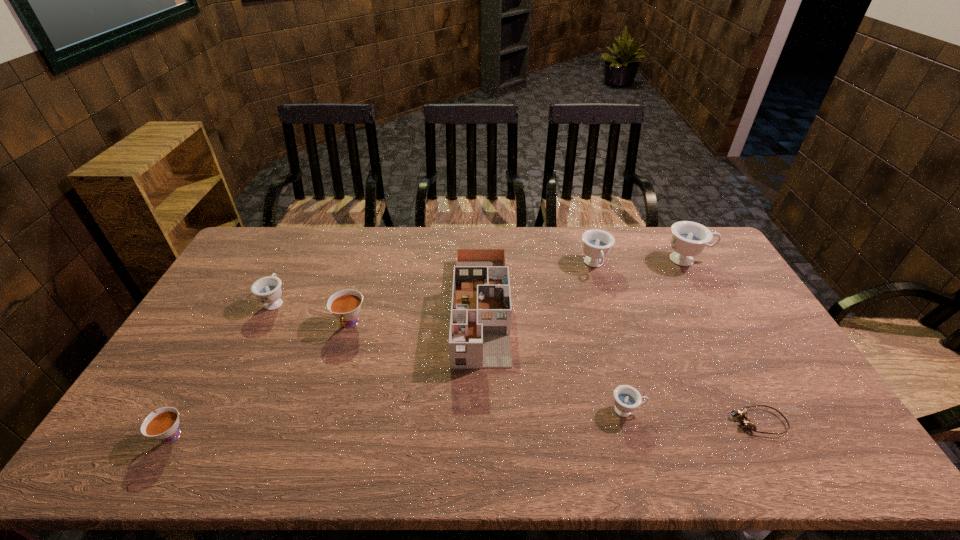
Identify which teacup is the fourth nearest to the white dollhouse. Please provide its 2D coordinates. Your answer should be formatted as a tuple, i.e. [(x, y)], where the tuple contains the x and y coordinates of a point satisfying the conditions above.

[(268, 290)]

Where is `teacup that is the fourth closest one to the second biggest blue teacup`? The height and width of the screenshot is (540, 960). teacup that is the fourth closest one to the second biggest blue teacup is located at coordinates (268, 290).

Where is `the closest blue teacup relative to the second teacup from left to right`? the closest blue teacup relative to the second teacup from left to right is located at coordinates (597, 243).

Locate which blue teacup ranks second in proximity to the second biggest blue teacup. Please provide its 2D coordinates. Your answer should be formatted as a tuple, i.e. [(x, y)], where the tuple contains the x and y coordinates of a point satisfying the conditions above.

[(626, 398)]

Find the location of `free space in the image that satisfies the following two spatial constraints: 1. at the front door of the dollhouse; 2. on the side of the smaller white teacup with the handle`. free space in the image that satisfies the following two spatial constraints: 1. at the front door of the dollhouse; 2. on the side of the smaller white teacup with the handle is located at coordinates coord(482,436).

Locate an element on the screen. The image size is (960, 540). free space in the image that satisfies the following two spatial constraints: 1. on the side of the second biggest blue teacup with the handle; 2. on the side of the nearer white teacup with the handle is located at coordinates (647, 436).